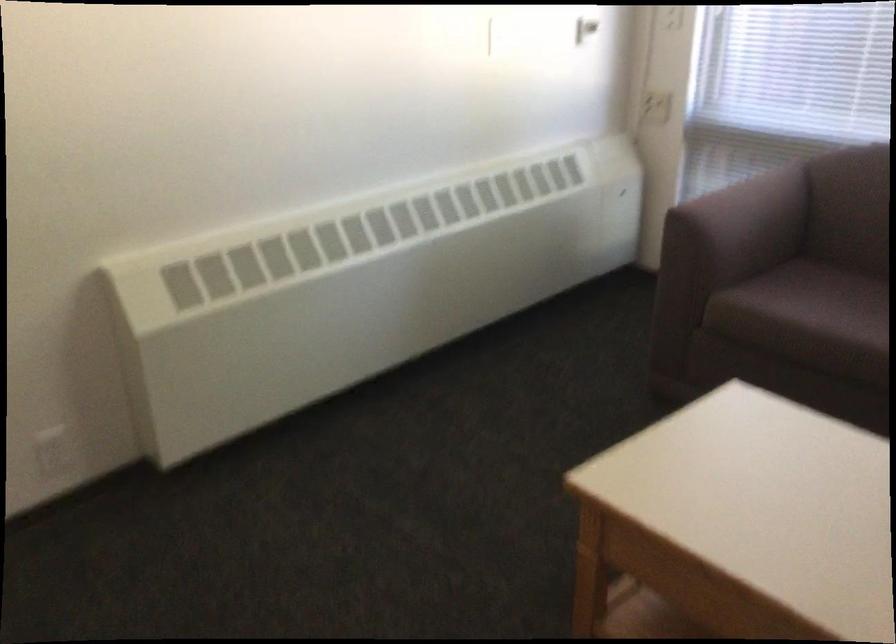
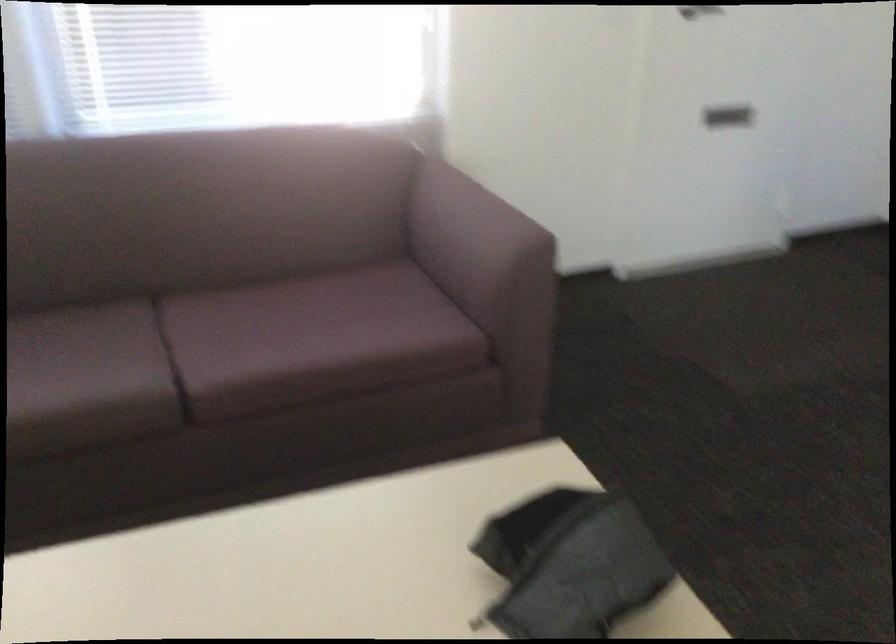
How did the camera likely rotate?

The rotation direction of the camera is right-down.